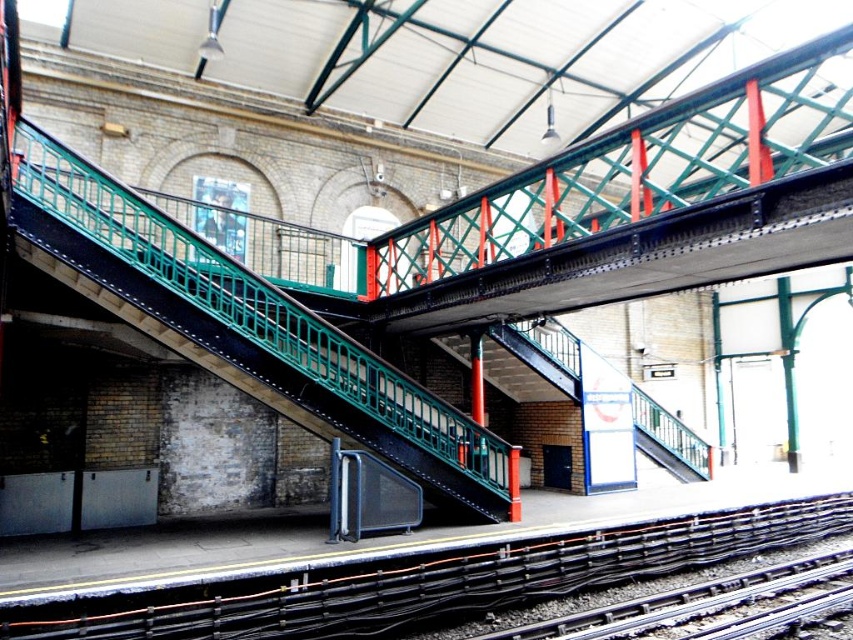
You are standing on the train station platform and want to determine the relative positions of two points marked on the scene. Which point is closer to you, point (381, 371) or point (712, 593)?

Point (381, 371) is further to the viewer than point (712, 593), so point (712, 593) is closer to you.

You are a maintenance worker needing to inspect both the black metal train track at lower left and the smooth steel tracks at bottom right. Given that your inspection equipment has a maximum reach of 5 feet, can you inspect both tracks without moving your position?

The distance between the black metal train track at lower left and the smooth steel tracks at bottom right is 4.66 feet, so yes, you can inspect both tracks without moving your position since the equipment can reach up to 5 feet.

You are a maintenance worker needing to reach the smooth steel tracks at bottom right from the green metal staircase at center. Given that your ladder is 10 feet long, will it be sufficient to bridge the gap between them?

The distance between the green metal staircase at center and the smooth steel tracks at bottom right is 10.97 feet, so the ladder is not long enough to bridge the gap since it is only 10 feet long.